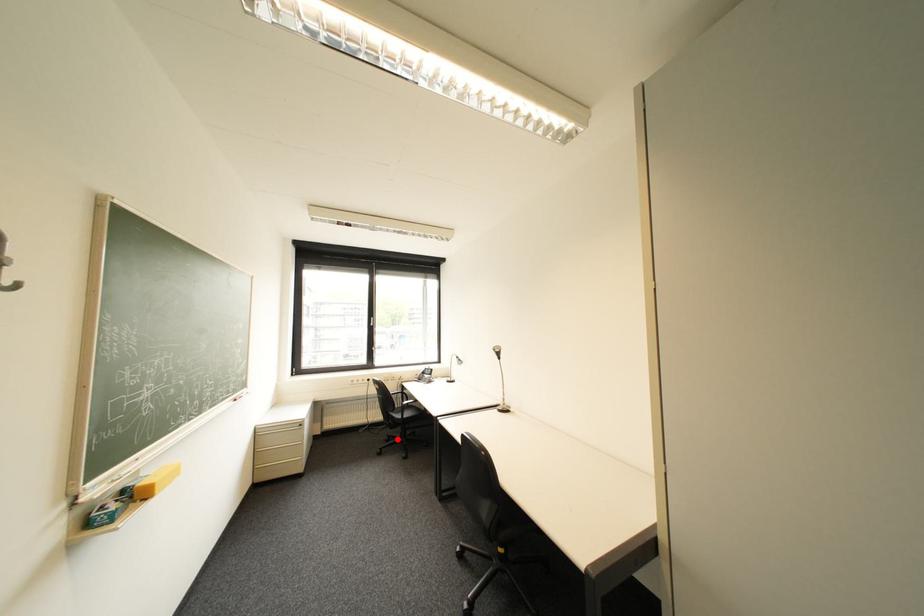
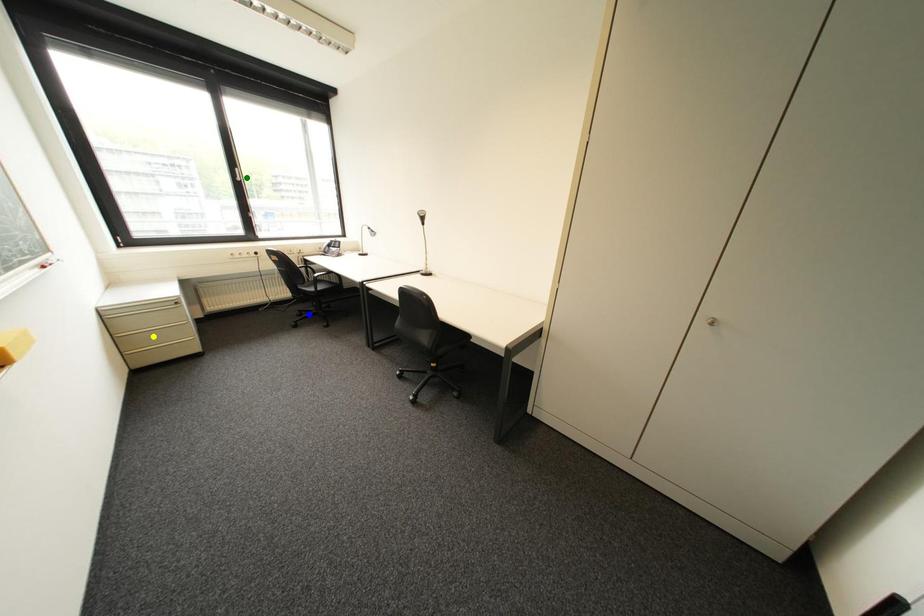
Question: I am providing you with two images of the same scene from different viewpoints. A red point is marked on the first image. You are given multiple points on the second image. Can you choose the point in image 2 that corresponds to the point in image 1?

Choices:
 (A) yellow point
 (B) green point
 (C) blue point

Answer: (C)